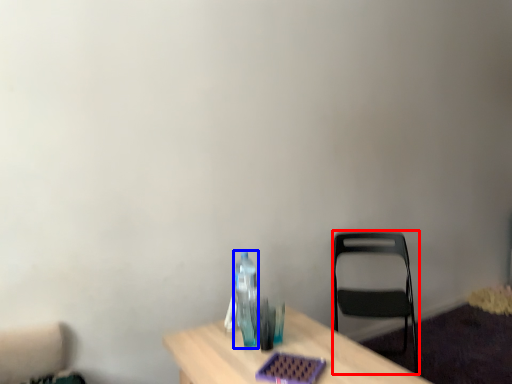
Question: Among these objects, which one is farthest to the camera, chair (highlighted by a red box) or bottle (highlighted by a blue box)?

Choices:
 (A) chair
 (B) bottle

Answer: (A)